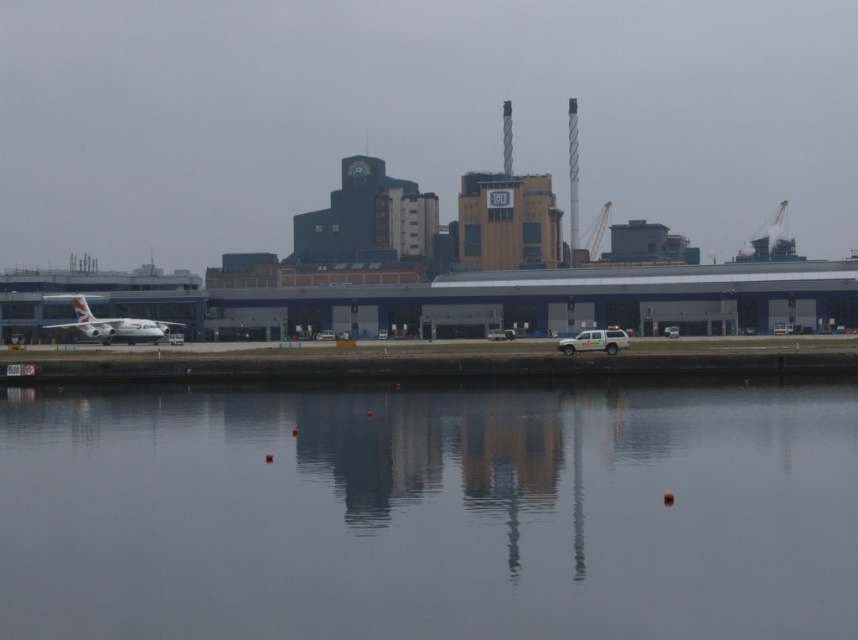
Can you confirm if transparent glass water at center is thinner than silver metallic airplane at left?

No.

Measure the distance between point [33,456] and camera.

Point [33,456] is 37.54 meters from camera.

Does point (642, 483) come behind point (77, 321)?

No, (642, 483) is closer to viewer.

In order to click on transparent glass water at center in this screenshot , I will do `click(429, 513)`.